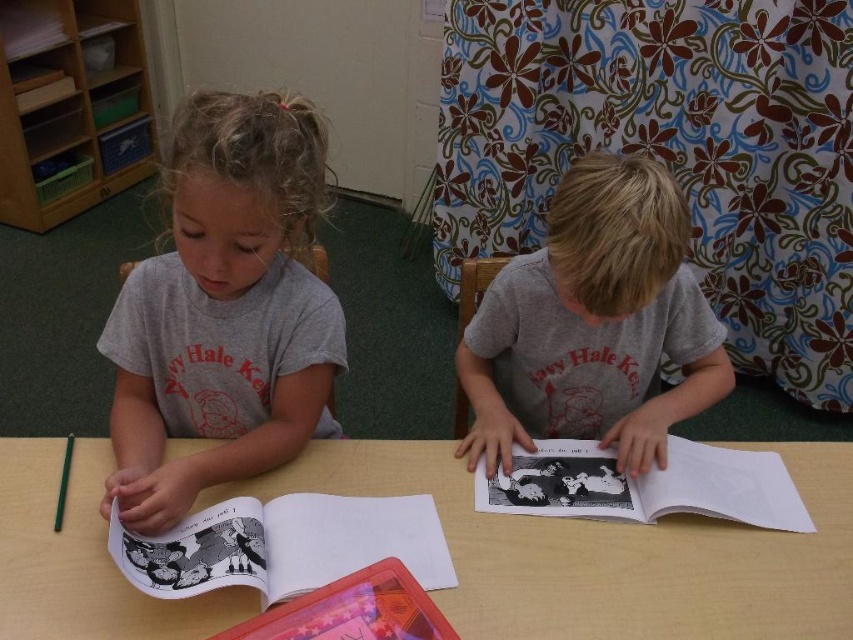
Question: Does wooden table at center appear over black paper book at lower left?

Choices:
 (A) no
 (B) yes

Answer: (B)

Question: Is gray matte shirt at left to the left of translucent plastic book at center from the viewer's perspective?

Choices:
 (A) yes
 (B) no

Answer: (A)

Question: Estimate the real-world distances between objects in this image. Which object is closer to the wooden table at center?

Choices:
 (A) black paper book at center
 (B) translucent plastic book at center
 (C) black paper book at lower left

Answer: (C)

Question: Based on their relative distances, which object is nearer to the wooden table at center?

Choices:
 (A) gray matte shirt at center
 (B) black paper book at lower left
 (C) gray matte shirt at left
 (D) translucent plastic book at center

Answer: (B)

Question: Which point is farther from the camera taking this photo?

Choices:
 (A) (628, 396)
 (B) (128, 406)
 (C) (120, 628)

Answer: (A)

Question: Is gray matte shirt at left below black paper book at center?

Choices:
 (A) yes
 (B) no

Answer: (B)